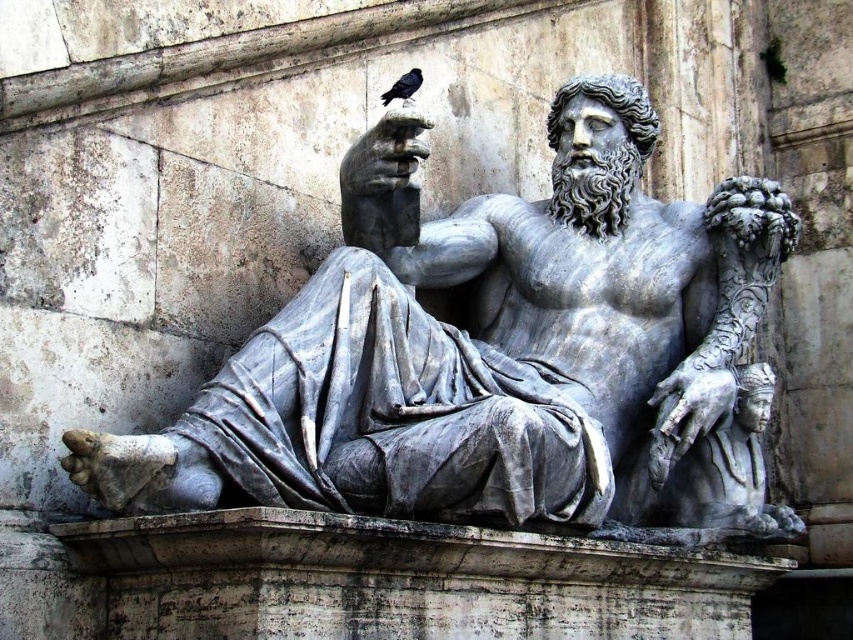
Question: Which object is farther from the camera taking this photo?

Choices:
 (A) gray marble statue at center
 (B) black feathered bird at upper center

Answer: (B)

Question: Does gray marble statue at center have a greater width compared to black feathered bird at upper center?

Choices:
 (A) yes
 (B) no

Answer: (A)

Question: Does gray marble statue at center have a lesser width compared to black feathered bird at upper center?

Choices:
 (A) yes
 (B) no

Answer: (B)

Question: Can you confirm if gray marble statue at center is bigger than black feathered bird at upper center?

Choices:
 (A) no
 (B) yes

Answer: (B)

Question: Which of the following is the farthest from the observer?

Choices:
 (A) (412, 68)
 (B) (532, 428)

Answer: (A)

Question: Among these objects, which one is nearest to the camera?

Choices:
 (A) black feathered bird at upper center
 (B) gray marble statue at center

Answer: (B)